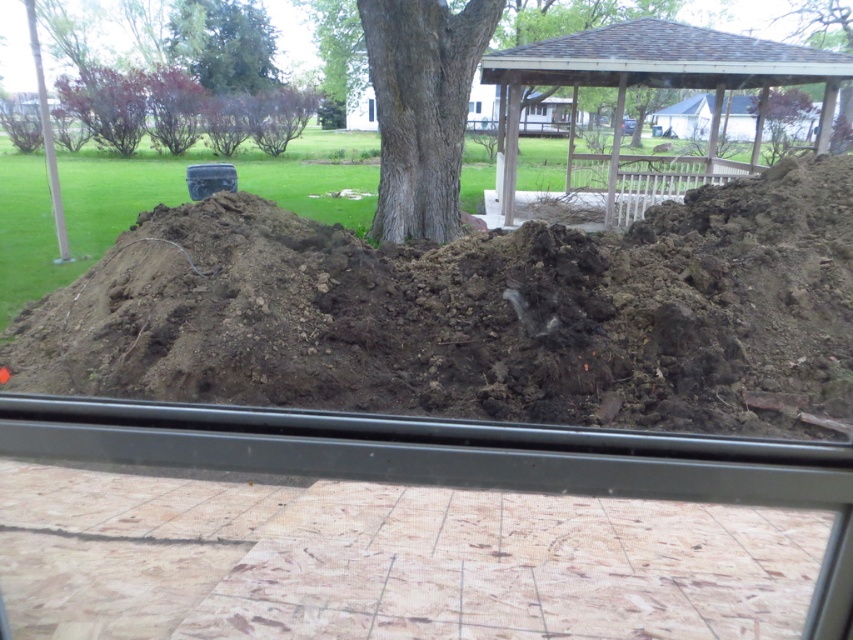
Question: In this image, where is brown wooden gazebo at upper center located relative to gray textured bark tree at center?

Choices:
 (A) below
 (B) above

Answer: (B)

Question: Does brown wooden gazebo at upper center appear on the right side of gray textured bark tree at center?

Choices:
 (A) no
 (B) yes

Answer: (B)

Question: Is gray textured bark tree at center wider than transparent glass window at center?

Choices:
 (A) yes
 (B) no

Answer: (A)

Question: Estimate the real-world distances between objects in this image. Which object is farther from the gray textured bark tree at center?

Choices:
 (A) brown dirt at center
 (B) brown wooden gazebo at upper center
 (C) transparent glass window at center

Answer: (C)

Question: Which point is farther to the camera?

Choices:
 (A) (469, 80)
 (B) (370, 106)

Answer: (B)

Question: Which point is farther to the camera?

Choices:
 (A) (769, 131)
 (B) (630, 84)
 (C) (238, 250)
 (D) (368, 100)

Answer: (D)